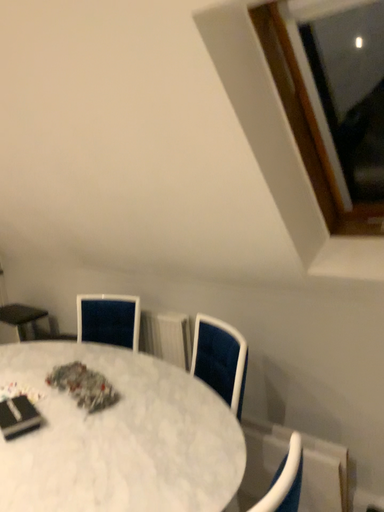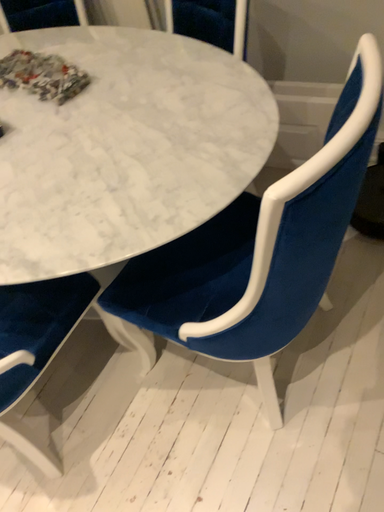
Question: How did the camera likely rotate when shooting the video?

Choices:
 (A) rotated upward
 (B) rotated downward

Answer: (B)